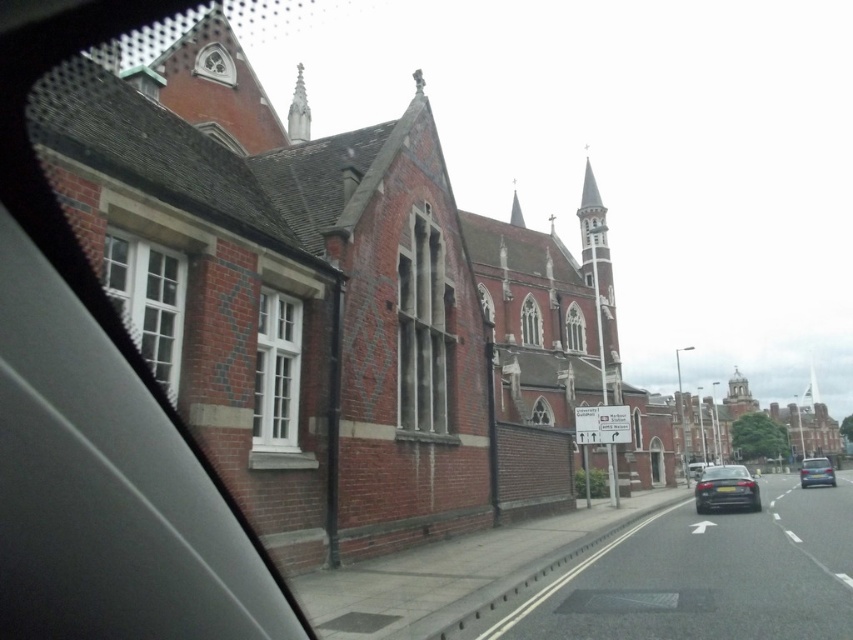
Does clear glass window at center lie behind metallic silver car at center-right?

Yes.

Which is below, clear glass window at center or metallic silver car at center-right?

metallic silver car at center-right is lower down.

At what (x,y) coordinates should I click in order to perform the action: click on clear glass window at center. Please return your answer as a coordinate pair (x, y). Image resolution: width=853 pixels, height=640 pixels. Looking at the image, I should click on (531, 323).

Does matte glass window at center have a greater width compared to white wood window at center?

Yes, matte glass window at center is wider than white wood window at center.

Find the location of a particular element. matte glass window at center is located at coordinates (422, 330).

At what (x,y) coordinates should I click in order to perform the action: click on matte glass window at center. Please return your answer as a coordinate pair (x, y). The height and width of the screenshot is (640, 853). Looking at the image, I should click on (422, 330).

Can you confirm if red brick church at center is positioned to the right of shiny black sedan at center-right?

No, red brick church at center is not to the right of shiny black sedan at center-right.

Who is more forward, (x=368, y=330) or (x=724, y=474)?

Positioned in front is point (x=368, y=330).

The height and width of the screenshot is (640, 853). In order to click on red brick church at center in this screenshot , I will do `click(341, 298)`.